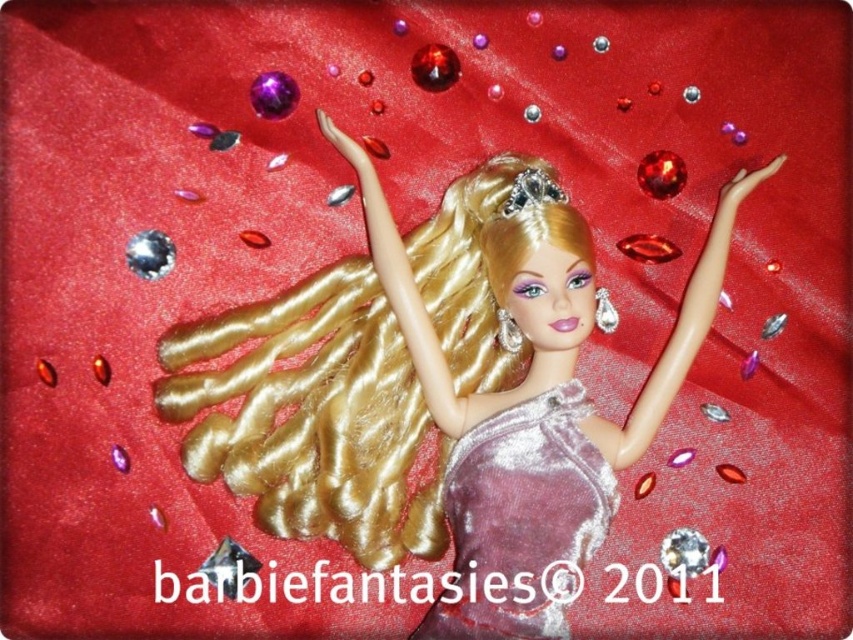
Question: Which point is closer to the camera?

Choices:
 (A) [476, 592]
 (B) [184, 358]

Answer: (A)

Question: Is shiny gold hair at center bigger than satin purple dress at center?

Choices:
 (A) no
 (B) yes

Answer: (B)

Question: In this image, where is shiny gold hair at center located relative to satin purple dress at center?

Choices:
 (A) left
 (B) right

Answer: (A)

Question: Is shiny gold hair at center positioned before satin purple dress at center?

Choices:
 (A) no
 (B) yes

Answer: (A)

Question: Which of the following is the farthest from the observer?

Choices:
 (A) shiny gold hair at center
 (B) satin purple dress at center

Answer: (A)